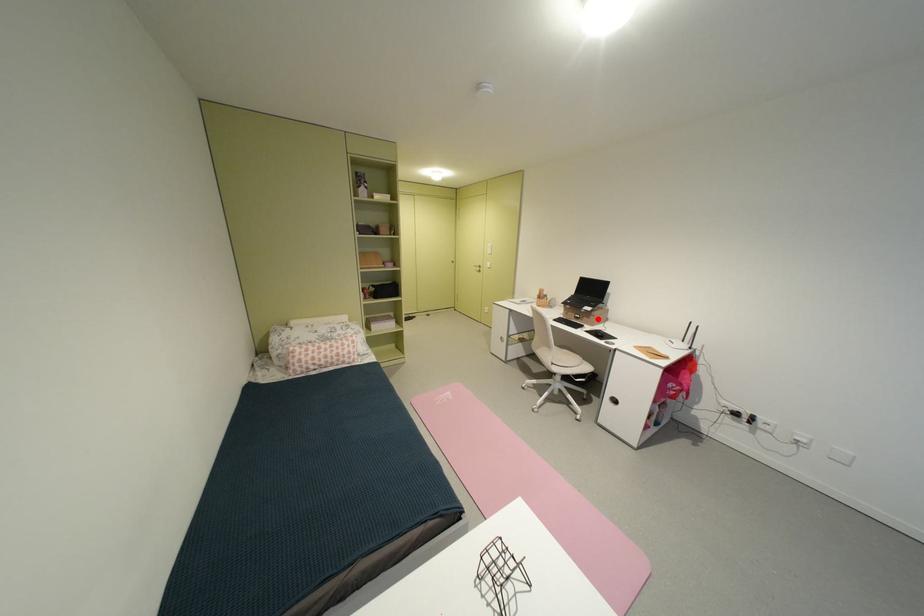
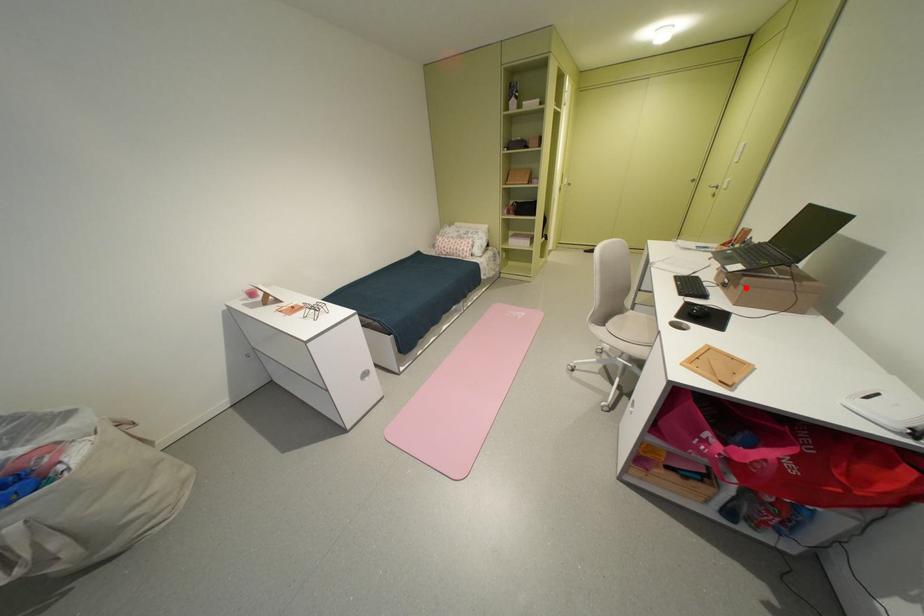
I am providing you with two images of the same scene from different viewpoints. A red point is marked on the first image and another point is marked on the second image. Do the highlighted points in image1 and image2 indicate the same real-world spot?

Yes